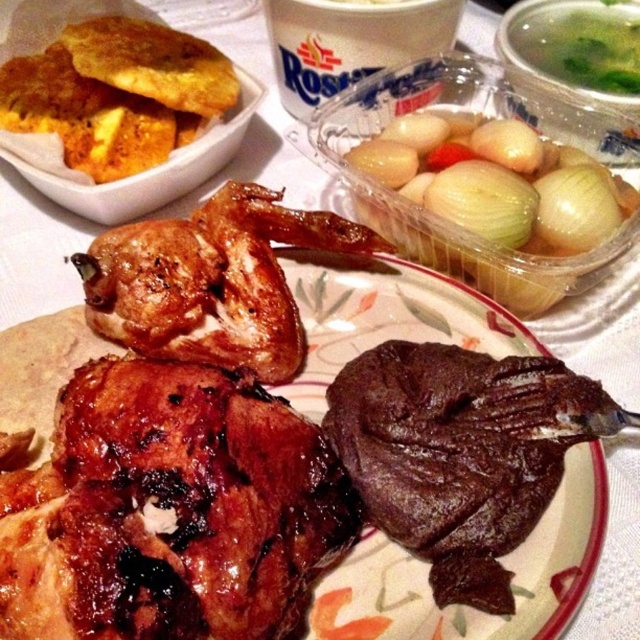
Question: From the image, what is the correct spatial relationship of brown crispy chicken at center in relation to green leafy vegetable at upper right?

Choices:
 (A) left
 (B) right

Answer: (A)

Question: Which point appears closest to the camera in this image?

Choices:
 (A) (134, 150)
 (B) (387, 208)
 (C) (228, 499)

Answer: (C)

Question: Which point is closer to the camera?

Choices:
 (A) (472, 186)
 (B) (465, 563)
 (C) (35, 81)

Answer: (B)

Question: Is the position of dark brown crispy meat at center less distant than that of brown crispy chicken at center?

Choices:
 (A) no
 (B) yes

Answer: (B)

Question: Can you confirm if brown crispy chicken at center is positioned to the left of green leafy vegetable at upper right?

Choices:
 (A) no
 (B) yes

Answer: (B)

Question: Which of the following is the farthest from the observer?

Choices:
 (A) [176, 51]
 (B) [81, 541]
 (C) [396, 422]

Answer: (A)